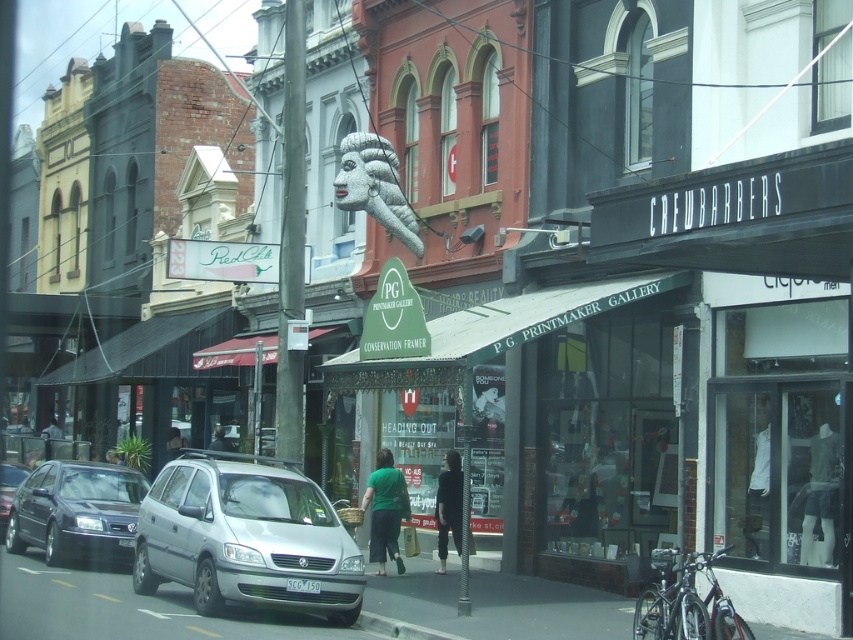
Question: Which is nearer to the dark hair at center?

Choices:
 (A) white textured sculpture at center
 (B) dark gray fabric jacket at center
 (C) green fabric shirt at center
 (D) silver metallic van at center

Answer: (B)

Question: Which of the following is the closest to the observer?

Choices:
 (A) (9, 497)
 (B) (363, 556)

Answer: (B)

Question: In this image, where is gray concrete pavement at lower center located relative to shiny silver sedan at left?

Choices:
 (A) right
 (B) left

Answer: (A)

Question: Can you confirm if smooth gray pole at center is thinner than dark green fabric jacket at center?

Choices:
 (A) yes
 (B) no

Answer: (A)

Question: Can you confirm if green fabric shirt at center is wider than green fabric person at center?

Choices:
 (A) no
 (B) yes

Answer: (A)

Question: Which object is the closest to the green fabric shirt at center?

Choices:
 (A) silver metallic van at center
 (B) gray concrete pavement at lower center

Answer: (B)